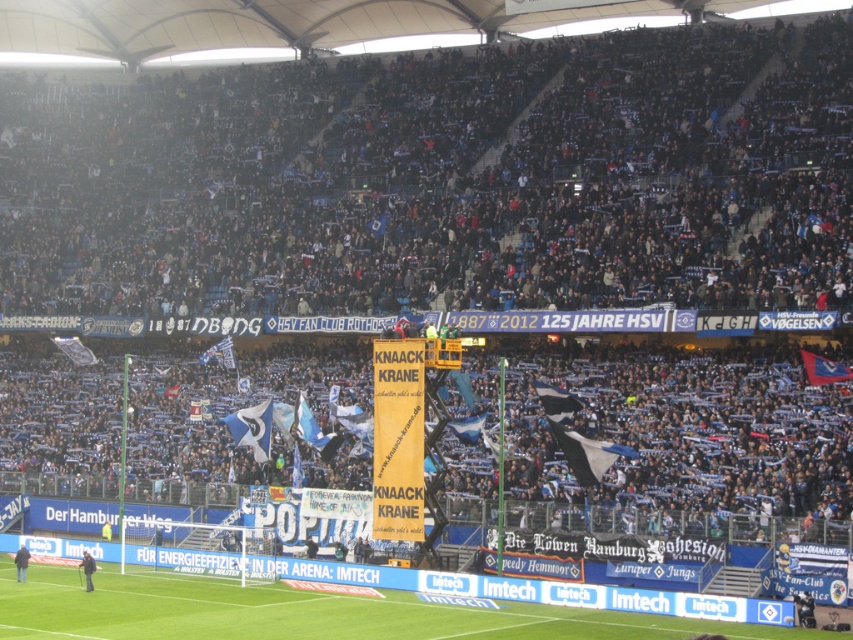
Question: Which object is positioned farthest from the dark blue fabric crowd at upper center?

Choices:
 (A) blue fabric flag at center
 (B) green grass football field at lower center

Answer: (B)

Question: Can you confirm if green grass football field at lower center is positioned to the left of blue fabric flag at center?

Choices:
 (A) no
 (B) yes

Answer: (A)

Question: Does dark blue fabric crowd at upper center have a larger size compared to green grass football field at lower center?

Choices:
 (A) yes
 (B) no

Answer: (A)

Question: Which point is farther from the camera taking this photo?

Choices:
 (A) (107, 620)
 (B) (712, 129)
 (C) (247, 440)

Answer: (B)

Question: Which object is positioned farthest from the green grass football field at lower center?

Choices:
 (A) blue fabric flag at center
 (B) dark blue fabric crowd at upper center

Answer: (B)

Question: Does green grass football field at lower center appear on the left side of blue fabric flag at center?

Choices:
 (A) yes
 (B) no

Answer: (B)